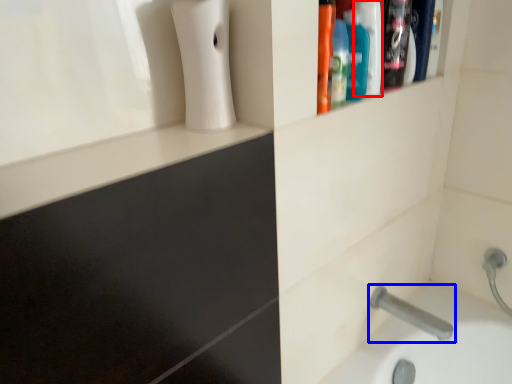
Question: Among these objects, which one is farthest to the camera, mouthwash (highlighted by a red box) or tap (highlighted by a blue box)?

Choices:
 (A) mouthwash
 (B) tap

Answer: (B)